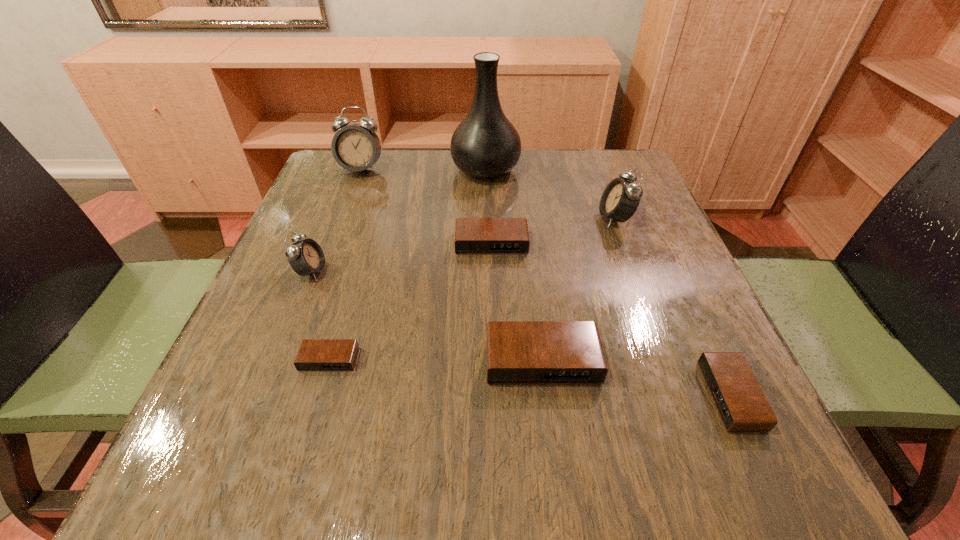
I want to click on free space between the fourth shortest alarm clock and the third smallest black alarm clock, so click(516, 302).

Find the location of `free space between the third farthest alarm clock and the shortest alarm clock`. free space between the third farthest alarm clock and the shortest alarm clock is located at coordinates (410, 301).

Where is `free space between the vase and the nearest white alarm clock`? Image resolution: width=960 pixels, height=540 pixels. free space between the vase and the nearest white alarm clock is located at coordinates pyautogui.click(x=398, y=220).

This screenshot has width=960, height=540. What are the coordinates of `free point between the biggest black alarm clock and the second object from right to left` in the screenshot? It's located at (579, 289).

At what (x,y) coordinates should I click in order to perform the action: click on vacant space that's between the fourth tallest alarm clock and the second smallest white alarm clock. Please return your answer as a coordinate pair (x, y). The image size is (960, 540). Looking at the image, I should click on (579, 289).

At what (x,y) coordinates should I click in order to perform the action: click on vacant area that lies between the fourth tallest alarm clock and the smallest white alarm clock. Please return your answer as a coordinate pair (x, y). This screenshot has width=960, height=540. Looking at the image, I should click on (427, 316).

At what (x,y) coordinates should I click in order to perform the action: click on blank region between the farthest alarm clock and the biggest black alarm clock. Please return your answer as a coordinate pair (x, y). The height and width of the screenshot is (540, 960). Looking at the image, I should click on (452, 265).

Choose which object is the seventh nearest neighbor to the vase. Please provide its 2D coordinates. Your answer should be formatted as a tuple, i.e. [(x, y)], where the tuple contains the x and y coordinates of a point satisfying the conditions above.

[(742, 406)]

Where is `object that ranks as the fifth closest to the fifth shortest alarm clock`? The width and height of the screenshot is (960, 540). object that ranks as the fifth closest to the fifth shortest alarm clock is located at coordinates (485, 145).

Locate which alarm clock ranks sixth in proximity to the third farthest alarm clock. Please provide its 2D coordinates. Your answer should be formatted as a tuple, i.e. [(x, y)], where the tuple contains the x and y coordinates of a point satisfying the conditions above.

[(742, 406)]